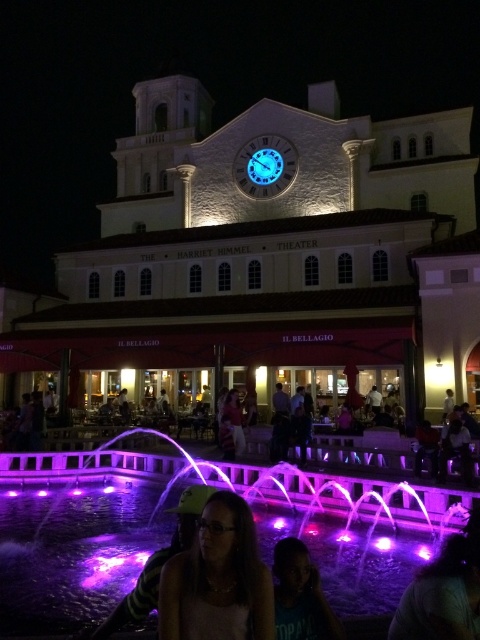
You are standing in the public square and want to take a photo of the white stone building at center and the purple illuminated water at lower center. Which object should you focus on first to ensure both are in the frame?

You should focus on the white stone building at center first because it is closer to you than the purple illuminated water at lower center, so adjusting the focus from near to far will help both objects be in the frame.

You are standing in the public square and want to take a photo of the white stone building at center and the smooth purple hair at lower right. Which object will appear larger in the photo?

The white stone building at center will appear larger in the photo because it has a greater height compared to the smooth purple hair at lower right.

You are standing at the point marked as point (261,256) in the image. What object are you directly facing?

You are directly facing the white stone building at center located at point (261,256).